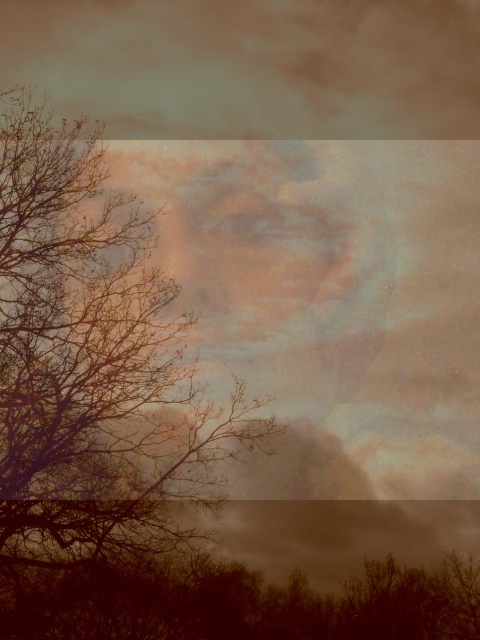
Between point (226, 451) and point (477, 573), which one is positioned behind?

Point (226, 451)

How much distance is there between brown leafless branches at left and brown matte tree at lower center?

15.63 feet

What do you see at coordinates (92, 358) in the screenshot?
I see `brown leafless branches at left` at bounding box center [92, 358].

The width and height of the screenshot is (480, 640). What are the coordinates of `brown leafless branches at left` in the screenshot? It's located at (92, 358).